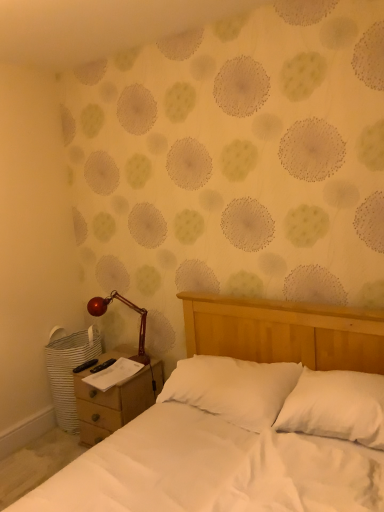
Question: Is wooden nightstand at lower left turned away from shiny red metal lamp at left?

Choices:
 (A) yes
 (B) no

Answer: (B)

Question: From a real-world perspective, is wooden nightstand at lower left on shiny red metal lamp at left?

Choices:
 (A) no
 (B) yes

Answer: (A)

Question: Does wooden nightstand at lower left have a greater height compared to shiny red metal lamp at left?

Choices:
 (A) no
 (B) yes

Answer: (B)

Question: Considering the relative positions of wooden nightstand at lower left and shiny red metal lamp at left in the image provided, is wooden nightstand at lower left to the left of shiny red metal lamp at left from the viewer's perspective?

Choices:
 (A) yes
 (B) no

Answer: (A)

Question: Is wooden nightstand at lower left completely or partially outside of shiny red metal lamp at left?

Choices:
 (A) yes
 (B) no

Answer: (A)

Question: Is wooden nightstand at lower left thinner than shiny red metal lamp at left?

Choices:
 (A) no
 (B) yes

Answer: (A)

Question: From the image's perspective, does white soft pillow at center, placed as the 1th pillow when sorted from left to right, appear lower than shiny red metal lamp at left?

Choices:
 (A) yes
 (B) no

Answer: (A)

Question: Can you confirm if white soft pillow at center, placed as the 1th pillow when sorted from left to right, is thinner than shiny red metal lamp at left?

Choices:
 (A) no
 (B) yes

Answer: (A)

Question: Is white soft pillow at center, the second pillow when ordered from right to left, at the left side of shiny red metal lamp at left?

Choices:
 (A) yes
 (B) no

Answer: (B)

Question: From a real-world perspective, does white soft pillow at center, placed as the 1th pillow when sorted from left to right, sit lower than shiny red metal lamp at left?

Choices:
 (A) no
 (B) yes

Answer: (B)

Question: Is white soft pillow at center, the second pillow when ordered from right to left, oriented towards shiny red metal lamp at left?

Choices:
 (A) yes
 (B) no

Answer: (B)

Question: Is white soft pillow at center, placed as the 1th pillow when sorted from left to right, wider than shiny red metal lamp at left?

Choices:
 (A) yes
 (B) no

Answer: (A)

Question: Is white soft pillow at center, which appears as the 2th pillow when viewed from the left, located outside shiny red metal lamp at left?

Choices:
 (A) yes
 (B) no

Answer: (A)